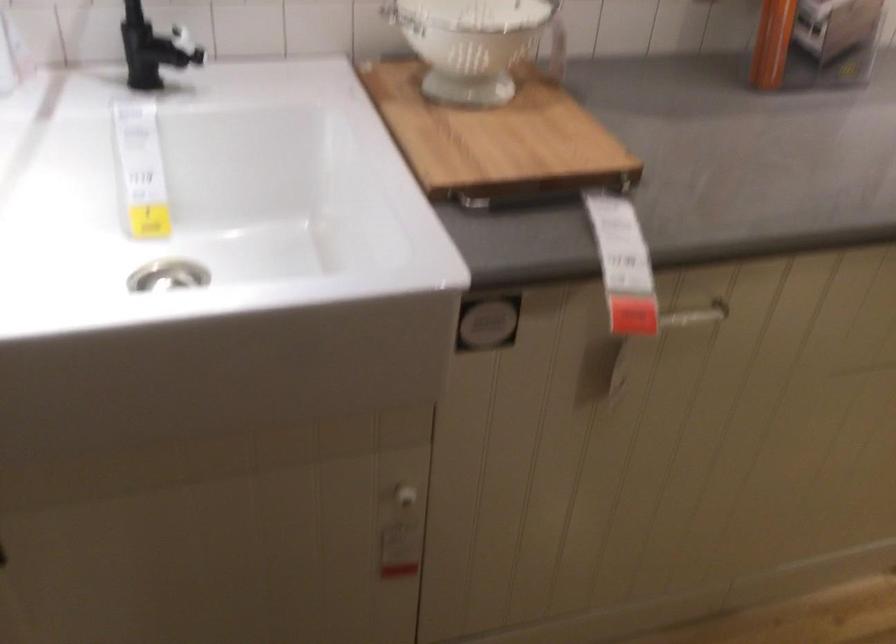
Locate an element on the screen. The height and width of the screenshot is (644, 896). wooden cutting board is located at coordinates click(495, 138).